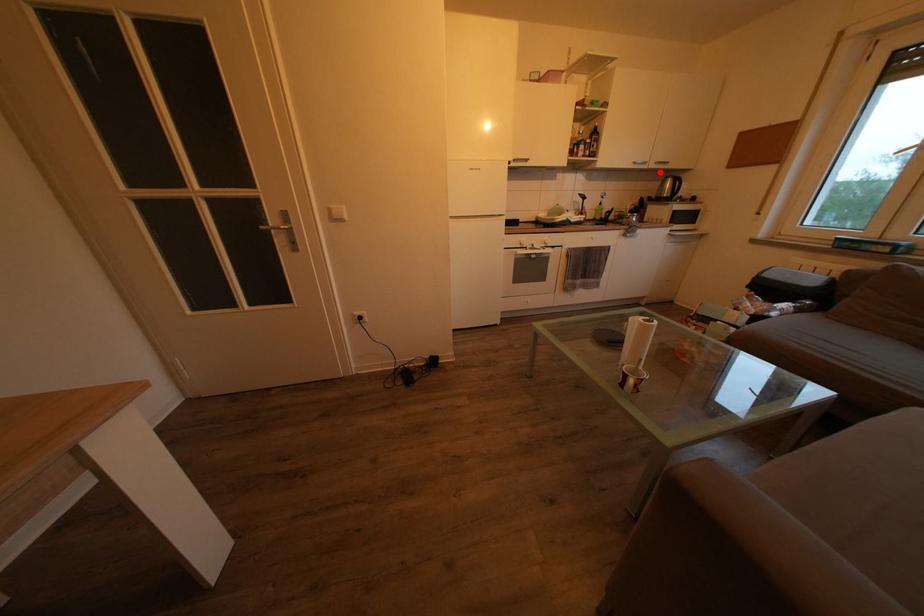
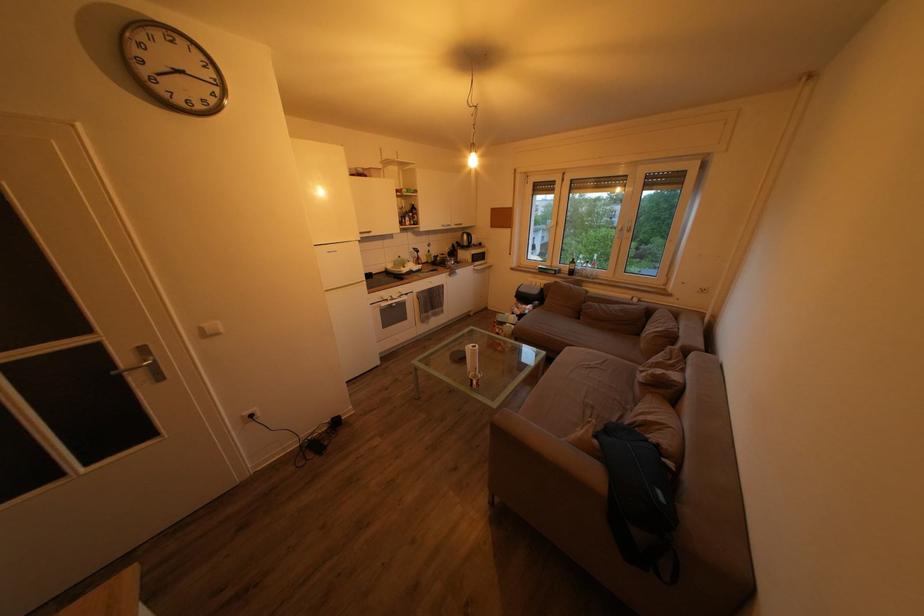
Question: I am providing you with two images of the same scene from different viewpoints. In image1, a red point is highlighted. Considering the same 3D point in image2, which of the following is correct?

Choices:
 (A) It is closer
 (B) It is farther

Answer: (A)